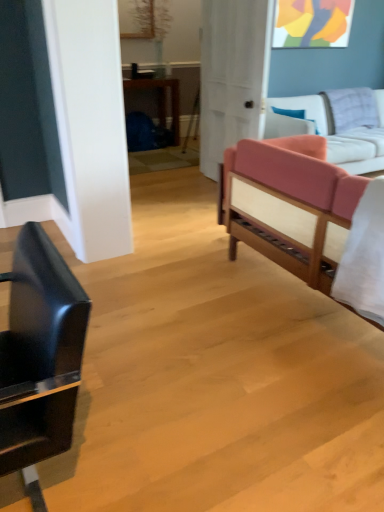
Find the location of a particular element. The image size is (384, 512). white cotton sheet at right is located at coordinates (364, 257).

Measure the distance between white matte door at center and camera.

The depth of white matte door at center is 3.17 meters.

You are a GUI agent. You are given a task and a screenshot of the screen. Output one action in this format:
    pyautogui.click(x=<x>, y=<y>)
    Task: Click on the shiny black chair at left
    This screenshot has height=512, width=384.
    Given the screenshot: What is the action you would take?
    pyautogui.click(x=40, y=353)

This screenshot has width=384, height=512. Find the location of `pink fabric studio couch at right, positioned as the first studio couch in back-to-front order`. pink fabric studio couch at right, positioned as the first studio couch in back-to-front order is located at coordinates (331, 132).

Describe the element at coordinates (289, 205) in the screenshot. I see `pink fabric couch at right, the second studio couch from the back` at that location.

Identify the location of white cotton sheet at right. The width and height of the screenshot is (384, 512). (364, 257).

Is white cotton sheet at right not within pink fabric couch at right, the 1th studio couch when ordered from front to back?

Actually, white cotton sheet at right is within pink fabric couch at right, the 1th studio couch when ordered from front to back.

Is white cotton sheet at right facing away from pink fabric couch at right, the 1th studio couch when ordered from front to back?

Yes, white cotton sheet at right's orientation is away from pink fabric couch at right, the 1th studio couch when ordered from front to back.

Would you say white cotton sheet at right is to the left or to the right of pink fabric couch at right, the 1th studio couch when ordered from front to back, in the picture?

From the image, it's evident that white cotton sheet at right is to the left of pink fabric couch at right, the 1th studio couch when ordered from front to back.

How distant is white cotton sheet at right from pink fabric couch at right, the 1th studio couch when ordered from front to back?

white cotton sheet at right is 14.74 inches away from pink fabric couch at right, the 1th studio couch when ordered from front to back.

Does white matte door at center appear on the right side of pink fabric studio couch at right, positioned as the first studio couch in back-to-front order?

Incorrect, white matte door at center is not on the right side of pink fabric studio couch at right, positioned as the first studio couch in back-to-front order.

From a real-world perspective, is white matte door at center below pink fabric studio couch at right, placed as the 2th studio couch when sorted from front to back?

No, from a real-world perspective, white matte door at center is not below pink fabric studio couch at right, placed as the 2th studio couch when sorted from front to back.

From the image's perspective, which one is positioned lower, white matte door at center or pink fabric studio couch at right, placed as the 2th studio couch when sorted from front to back?

pink fabric studio couch at right, placed as the 2th studio couch when sorted from front to back.

Is white matte door at center facing away from pink fabric studio couch at right, positioned as the first studio couch in back-to-front order?

Yes, white matte door at center is positioned with its back facing pink fabric studio couch at right, positioned as the first studio couch in back-to-front order.

Is white matte door at center inside or outside of pink fabric couch at right, the second studio couch from the back?

white matte door at center is located beyond the bounds of pink fabric couch at right, the second studio couch from the back.

Does white matte door at center have a larger size compared to pink fabric couch at right, the second studio couch from the back?

No.

Can you confirm if white matte door at center is positioned to the right of pink fabric couch at right, the 1th studio couch when ordered from front to back?

In fact, white matte door at center is to the left of pink fabric couch at right, the 1th studio couch when ordered from front to back.

Does white matte door at center lie in front of pink fabric couch at right, the second studio couch from the back?

No, it is not.

How different are the orientations of shiny black chair at left and pink fabric studio couch at right, placed as the 2th studio couch when sorted from front to back, in degrees?

88.5 degrees separate the facing orientations of shiny black chair at left and pink fabric studio couch at right, placed as the 2th studio couch when sorted from front to back.

You are a GUI agent. You are given a task and a screenshot of the screen. Output one action in this format:
    pyautogui.click(x=<x>, y=<y>)
    Task: Click on the 2nd studio couch positioned above the shiny black chair at left (from the image's perspective)
    
    Given the screenshot: What is the action you would take?
    pyautogui.click(x=331, y=132)

Does shiny black chair at left contain pink fabric studio couch at right, placed as the 2th studio couch when sorted from front to back?

Actually, pink fabric studio couch at right, placed as the 2th studio couch when sorted from front to back, is outside shiny black chair at left.

Is shiny black chair at left thinner than pink fabric studio couch at right, placed as the 2th studio couch when sorted from front to back?

Indeed, shiny black chair at left has a lesser width compared to pink fabric studio couch at right, placed as the 2th studio couch when sorted from front to back.

From a real-world perspective, is pink fabric studio couch at right, placed as the 2th studio couch when sorted from front to back, under white matte door at center?

Yes, from a real-world perspective, pink fabric studio couch at right, placed as the 2th studio couch when sorted from front to back, is beneath white matte door at center.

From the image's perspective, which object appears higher, pink fabric studio couch at right, placed as the 2th studio couch when sorted from front to back, or white matte door at center?

white matte door at center appears higher in the image.

Considering the points (363, 134) and (213, 2), which point is in front, point (363, 134) or point (213, 2)?

The point (213, 2) is in front.

Based on the photo, does pink fabric studio couch at right, positioned as the first studio couch in back-to-front order, appear on the left side of white matte door at center?

Incorrect, pink fabric studio couch at right, positioned as the first studio couch in back-to-front order, is not on the left side of white matte door at center.

Is pink fabric studio couch at right, placed as the 2th studio couch when sorted from front to back, at the back of pink fabric couch at right, the second studio couch from the back?

No, pink fabric studio couch at right, placed as the 2th studio couch when sorted from front to back, is not at the back of pink fabric couch at right, the second studio couch from the back.

Is pink fabric couch at right, the second studio couch from the back, beside pink fabric studio couch at right, positioned as the first studio couch in back-to-front order?

No, pink fabric couch at right, the second studio couch from the back, is not touching pink fabric studio couch at right, positioned as the first studio couch in back-to-front order.

Is pink fabric couch at right, the second studio couch from the back, positioned beyond the bounds of pink fabric studio couch at right, placed as the 2th studio couch when sorted from front to back?

Yes, pink fabric couch at right, the second studio couch from the back, is not within pink fabric studio couch at right, placed as the 2th studio couch when sorted from front to back.

From the image's perspective, which one is positioned higher, pink fabric couch at right, the 1th studio couch when ordered from front to back, or pink fabric studio couch at right, positioned as the first studio couch in back-to-front order?

From the image's view, pink fabric studio couch at right, positioned as the first studio couch in back-to-front order, is above.

Is point (352, 154) positioned before point (63, 431)?

No, it is not.

Are pink fabric studio couch at right, positioned as the first studio couch in back-to-front order, and shiny black chair at left beside each other?

They are not placed beside each other.

In the scene shown: Is shiny black chair at left at the back of pink fabric studio couch at right, positioned as the first studio couch in back-to-front order?

No.

At what (x,y) coordinates should I click in order to perform the action: click on sheet above the pink fabric couch at right, the second studio couch from the back (from a real-world perspective). Please return your answer as a coordinate pair (x, y). Looking at the image, I should click on (364, 257).

At what (x,y) coordinates should I click in order to perform the action: click on glass door above the pink fabric studio couch at right, positioned as the first studio couch in back-to-front order (from the image's perspective). Please return your answer as a coordinate pair (x, y). The width and height of the screenshot is (384, 512). Looking at the image, I should click on (233, 75).

From the picture: Estimate the real-world distances between objects in this image. Which object is closer to white matte door at center, pink fabric studio couch at right, positioned as the first studio couch in back-to-front order, or pink fabric couch at right, the second studio couch from the back?

pink fabric studio couch at right, positioned as the first studio couch in back-to-front order, is closer to white matte door at center.

Considering their positions, is white cotton sheet at right positioned further to shiny black chair at left than pink fabric studio couch at right, positioned as the first studio couch in back-to-front order?

pink fabric studio couch at right, positioned as the first studio couch in back-to-front order.

Looking at the image, which one is located further to pink fabric couch at right, the second studio couch from the back, white cotton sheet at right or white matte door at center?

The object further to pink fabric couch at right, the second studio couch from the back, is white matte door at center.

Estimate the real-world distances between objects in this image. Which object is closer to pink fabric studio couch at right, positioned as the first studio couch in back-to-front order, white matte door at center or shiny black chair at left?

white matte door at center is closer to pink fabric studio couch at right, positioned as the first studio couch in back-to-front order.

Based on their spatial positions, is white cotton sheet at right or pink fabric couch at right, the second studio couch from the back, closer to shiny black chair at left?

white cotton sheet at right lies closer to shiny black chair at left than the other object.

Considering their positions, is white matte door at center positioned closer to white cotton sheet at right than pink fabric couch at right, the second studio couch from the back?

Based on the image, pink fabric couch at right, the second studio couch from the back, appears to be nearer to white cotton sheet at right.

Looking at the image, which one is located closer to pink fabric studio couch at right, positioned as the first studio couch in back-to-front order, white cotton sheet at right or pink fabric couch at right, the 1th studio couch when ordered from front to back?

pink fabric couch at right, the 1th studio couch when ordered from front to back, is closer to pink fabric studio couch at right, positioned as the first studio couch in back-to-front order.

Which object lies nearer to the anchor point shiny black chair at left, pink fabric studio couch at right, positioned as the first studio couch in back-to-front order, or white cotton sheet at right?

Among the two, white cotton sheet at right is located nearer to shiny black chair at left.

Where is `studio couch between shiny black chair at left and white matte door at center along the z-axis`? The width and height of the screenshot is (384, 512). studio couch between shiny black chair at left and white matte door at center along the z-axis is located at coordinates (289, 205).

Locate an element on the screen. This screenshot has width=384, height=512. studio couch between white cotton sheet at right and white matte door at center along the z-axis is located at coordinates (289, 205).

The image size is (384, 512). I want to click on glass door positioned between pink fabric couch at right, the second studio couch from the back, and pink fabric studio couch at right, placed as the 2th studio couch when sorted from front to back, from near to far, so click(233, 75).

The image size is (384, 512). Find the location of `sheet between shiny black chair at left and white matte door at center along the z-axis`. sheet between shiny black chair at left and white matte door at center along the z-axis is located at coordinates (x=364, y=257).